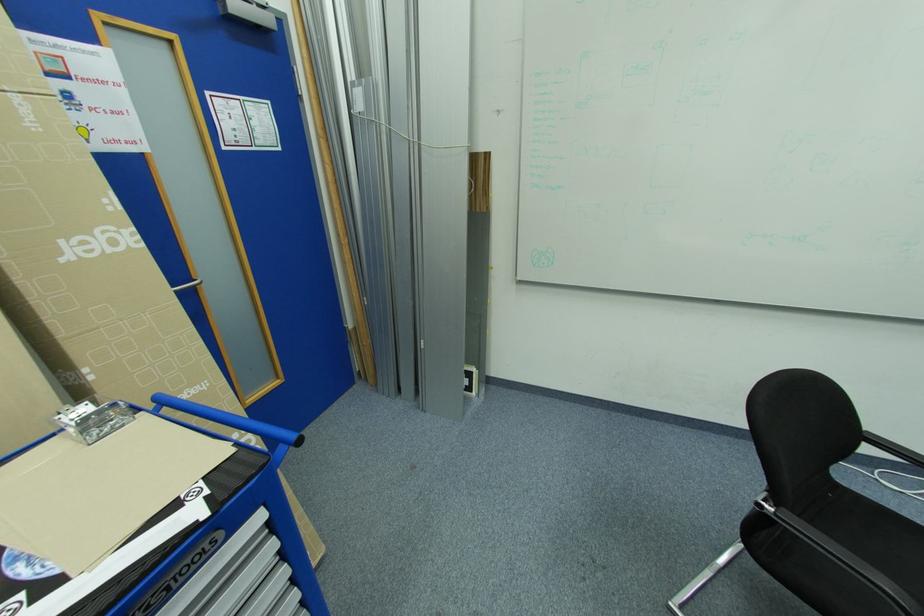
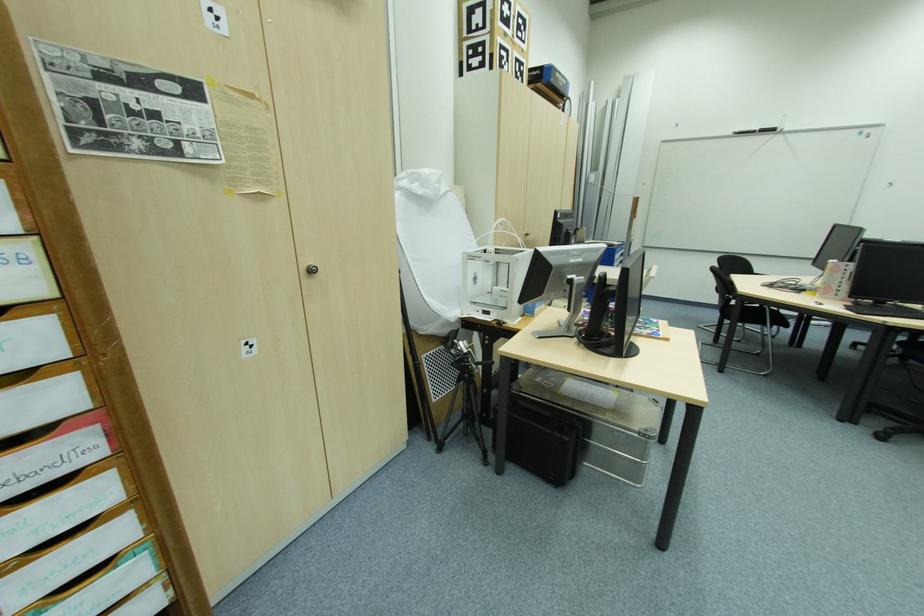
In the scene shown: Which direction would the cameraman need to move to produce the second image?

The cameraman walked toward left, backward.